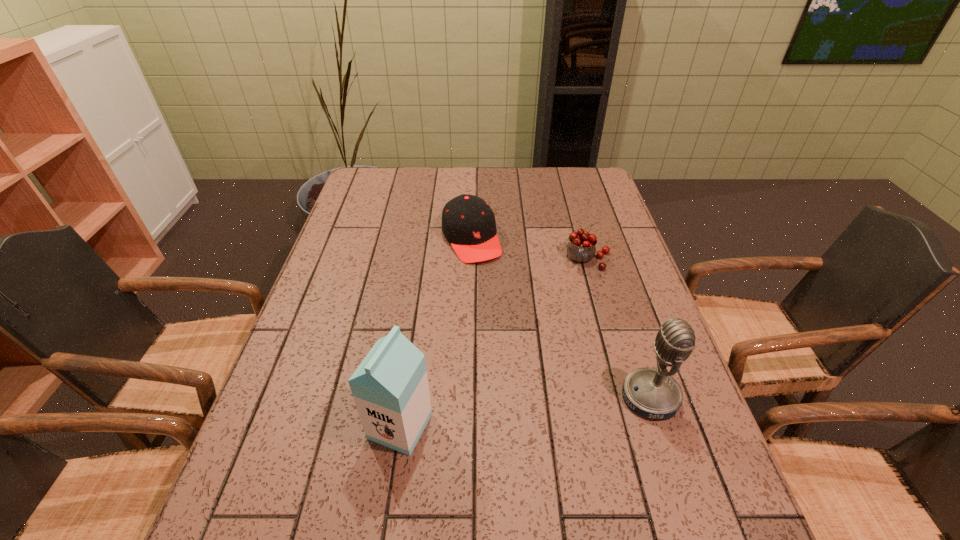
The image size is (960, 540). Identify the location of vacant space on the desktop that is between the milk carton and the microphone and is positioned on the front-facing side of the cap. (561, 408).

Identify the location of vacant space on the desktop that is between the milk carton and the microphone and is positioned on the handle side of the pot filled with cherries. The image size is (960, 540). (564, 407).